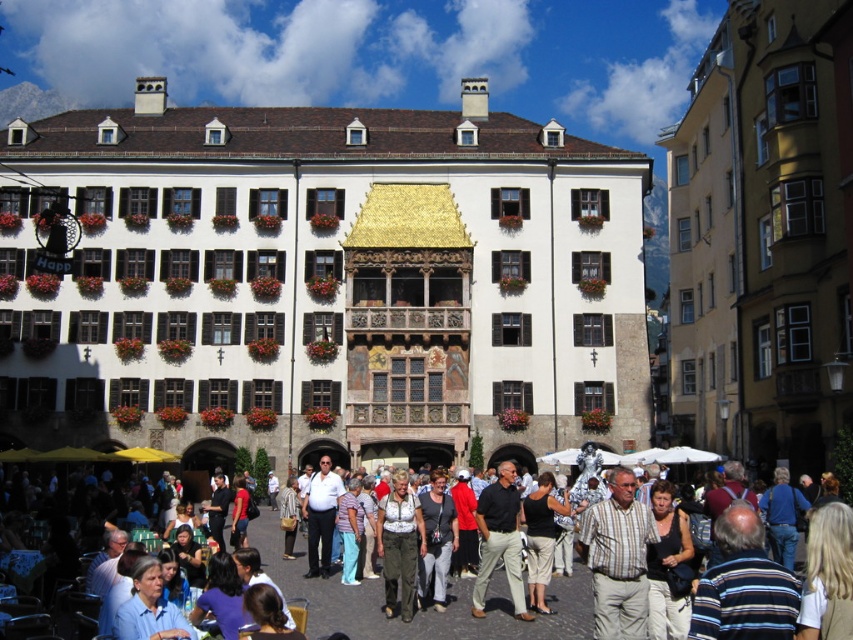
You are standing in the town square and want to take a photo of both the golden roofed building and a flower box. The golden roofed building is located at point (393, 588) and the flower box is at point (519, 616). Since you want both in the frame, will you need to adjust your camera angle upwards or downwards to include both points in your photo?

Point (393, 588) is closer to the camera than point (519, 616). To include both in the photo, you would need to adjust your camera angle upwards because the flower box at point (519, 616) is further away and lower in the frame.

You are a photographer standing in the town square and want to take a photo of both the matte black shirt at center and the black cotton shirt at center. Which of the two shirts should you focus on first to ensure both are in clear view?

You should focus on the matte black shirt at center first since it is closer to the viewer than the black cotton shirt at center, ensuring both will be in focus when using a proper depth of field.